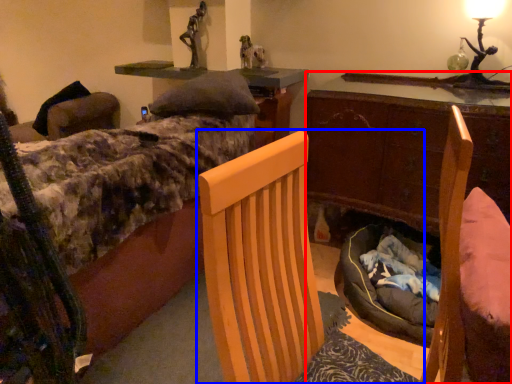
Question: Which object is further to the camera taking this photo, desk (highlighted by a red box) or chair (highlighted by a blue box)?

Choices:
 (A) desk
 (B) chair

Answer: (A)